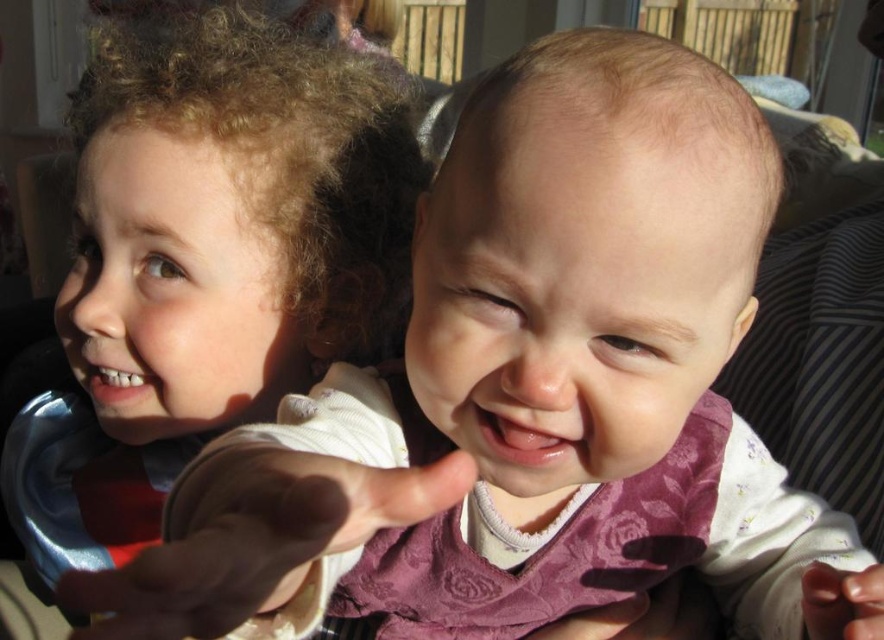
Question: Is smooth white hand at center thinner than smooth skin hand at center?

Choices:
 (A) yes
 (B) no

Answer: (B)

Question: Is smooth white hand at center further to camera compared to smooth skin hand at center?

Choices:
 (A) no
 (B) yes

Answer: (A)

Question: Which point is farther to the camera?

Choices:
 (A) smooth white hand at center
 (B) curly hair at upper left
 (C) smooth skin hand at center

Answer: (B)

Question: Which point is farther to the camera?

Choices:
 (A) smooth white hand at center
 (B) smooth skin hand at center
 (C) curly hair at upper left

Answer: (C)

Question: Which object is closer to the camera taking this photo?

Choices:
 (A) smooth skin hand at center
 (B) curly hair at upper left
 (C) smooth white hand at center

Answer: (C)

Question: Is curly hair at upper left further to the viewer compared to smooth skin hand at center?

Choices:
 (A) no
 (B) yes

Answer: (B)